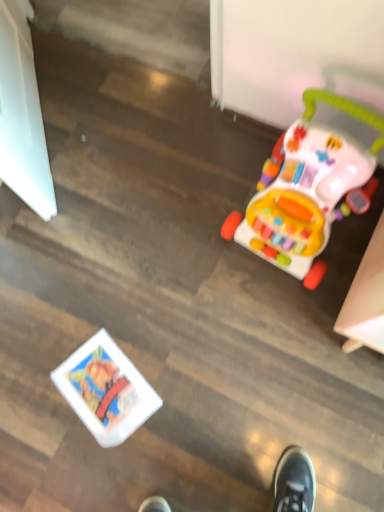
This screenshot has width=384, height=512. In order to click on vacant area that lies between multicolored plastic walker at right, which ranks as the 2th toy in left-to-right order, and white glossy book at lower left, which is the 2th toy from right to left in this screenshot , I will do [203, 303].